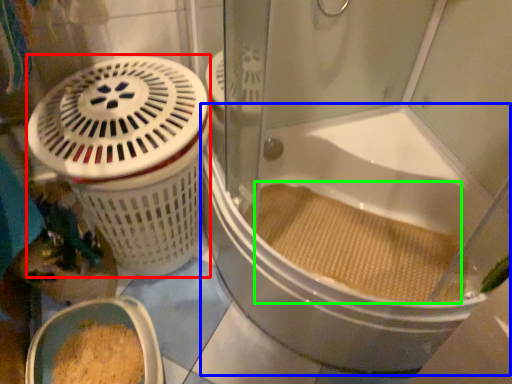
Question: Based on their relative distances, which object is nearer to basket container (highlighted by a red box)? Choose from bathtub (highlighted by a blue box) and debris (highlighted by a green box).

Choices:
 (A) bathtub
 (B) debris

Answer: (A)